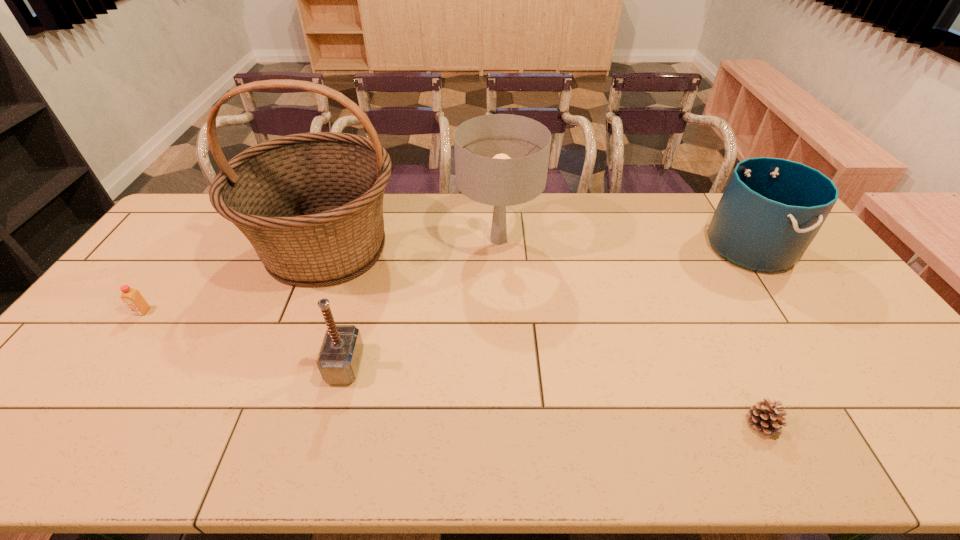
Find the location of `free space located on the front-facing side of the second tallest object`. free space located on the front-facing side of the second tallest object is located at coordinates (505, 372).

I want to click on free region located 0.050m on the right of the bucket, so click(x=806, y=246).

Where is `vacant space located on the front of the fifth farthest object`? The height and width of the screenshot is (540, 960). vacant space located on the front of the fifth farthest object is located at coordinates click(x=322, y=455).

Where is `free point located on the front and back of the orange juice`? The height and width of the screenshot is (540, 960). free point located on the front and back of the orange juice is located at coordinates (65, 417).

The height and width of the screenshot is (540, 960). Find the location of `free spot located on the right of the pinecone`. free spot located on the right of the pinecone is located at coordinates (948, 424).

Where is `basket that is at the far edge`? basket that is at the far edge is located at coordinates (311, 204).

Find the location of `lampshade located at the far edge`. lampshade located at the far edge is located at coordinates (502, 160).

Locate an element on the screen. bucket that is at the far edge is located at coordinates (771, 210).

In order to click on object at the near edge in this screenshot , I will do `click(765, 416)`.

Where is `object located in the left edge section of the desktop`? The image size is (960, 540). object located in the left edge section of the desktop is located at coordinates (132, 298).